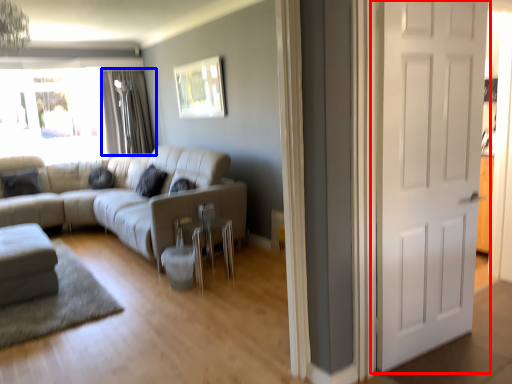
Question: Which of the following is the closest to the observer, door (highlighted by a red box) or curtain (highlighted by a blue box)?

Choices:
 (A) door
 (B) curtain

Answer: (A)